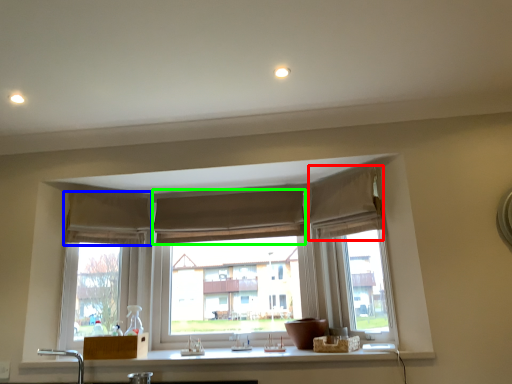
Question: Based on their relative distances, which object is farther from curtain (highlighted by a red box)? Choose from curtain (highlighted by a blue box) and curtain (highlighted by a green box).

Choices:
 (A) curtain
 (B) curtain

Answer: (A)